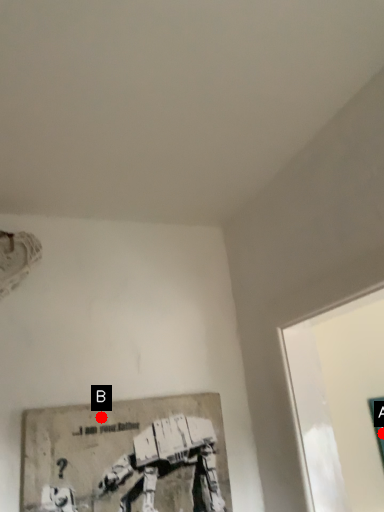
Question: Two points are circled on the image, labeled by A and B beside each circle. Which point is closer to the camera?

Choices:
 (A) A is closer
 (B) B is closer

Answer: (B)